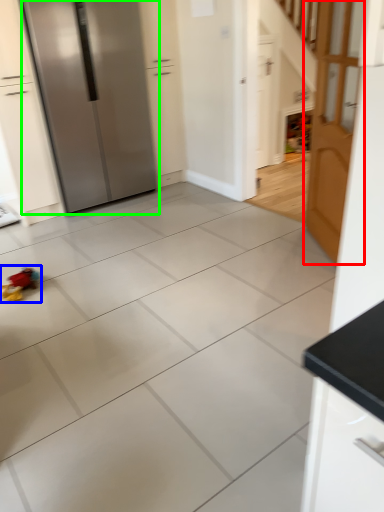
Question: Which object is positioned closest to door (highlighted by a red box)? Select from toy (highlighted by a blue box) and refrigerator (highlighted by a green box).

Choices:
 (A) toy
 (B) refrigerator

Answer: (B)